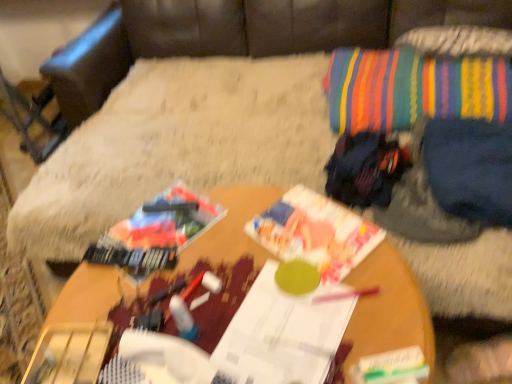
This screenshot has width=512, height=384. Find the location of `wooden table at center`. wooden table at center is located at coordinates (388, 308).

Describe the element at coordinates (388, 308) in the screenshot. I see `wooden table at center` at that location.

Describe the element at coordinates (412, 89) in the screenshot. I see `striped fabric throw pillow at upper right` at that location.

Image resolution: width=512 pixels, height=384 pixels. Find the location of `dark blue fabric at upper right`. dark blue fabric at upper right is located at coordinates (470, 168).

Identify the location of multicolored fabric bean bag chair at upper right. The height and width of the screenshot is (384, 512). (247, 34).

You are a GUI agent. You are given a task and a screenshot of the screen. Output one action in this format:
    pyautogui.click(x=<x>, y=<y>)
    Task: Click on the wooden table at center
    Image resolution: width=512 pixels, height=384 pixels.
    Given the screenshot: What is the action you would take?
    pyautogui.click(x=388, y=308)

From a real-world perspective, is dark blue fabric at upper right above or below multicolored fabric bean bag chair at upper right?

Clearly, from a real-world perspective, dark blue fabric at upper right is above multicolored fabric bean bag chair at upper right.

Which is behind, point (510, 200) or point (229, 27)?

Positioned behind is point (229, 27).

Is dark blue fabric at upper right positioned with its back to multicolored fabric bean bag chair at upper right?

Correct, dark blue fabric at upper right is looking away from multicolored fabric bean bag chair at upper right.

From the picture: Which object is more forward, dark blue fabric at upper right or multicolored fabric bean bag chair at upper right?

multicolored fabric bean bag chair at upper right is in front.

From a real-world perspective, is printed paper magazine at center, positioned as the 1th magazine in top-to-bottom order, over white paper magazine at center, positioned as the 1th magazine in bottom-to-top order?

Correct, in the physical world, printed paper magazine at center, positioned as the 1th magazine in top-to-bottom order, is higher than white paper magazine at center, positioned as the 1th magazine in bottom-to-top order.

This screenshot has width=512, height=384. There is a white paper magazine at center, positioned as the 1th magazine in bottom-to-top order. In order to click on magazine above it (from a real-world perspective) in this screenshot , I will do `click(315, 232)`.

Is point (372, 225) closer or farther from the camera than point (215, 348)?

Clearly, point (372, 225) is more distant from the camera than point (215, 348).

Considering the sizes of objects wooden table at center and printed paper magazine at center, positioned as the 1th magazine in top-to-bottom order, in the image provided, who is wider, wooden table at center or printed paper magazine at center, positioned as the 1th magazine in top-to-bottom order,?

wooden table at center.

Is wooden table at center looking in the opposite direction of printed paper magazine at center, positioned as the 2th magazine in bottom-to-top order?

That's not correct — wooden table at center is not looking away from printed paper magazine at center, positioned as the 2th magazine in bottom-to-top order.

From the picture: From the image's perspective, does wooden table at center appear lower than printed paper magazine at center, positioned as the 1th magazine in top-to-bottom order?

Yes, from the image's perspective, wooden table at center is beneath printed paper magazine at center, positioned as the 1th magazine in top-to-bottom order.

Visually, is wooden table at center positioned to the left or to the right of printed paper magazine at center, positioned as the 1th magazine in top-to-bottom order?

Clearly, wooden table at center is on the left of printed paper magazine at center, positioned as the 1th magazine in top-to-bottom order, in the image.

Is dark blue fabric at upper right further to camera compared to striped fabric throw pillow at upper right?

No, dark blue fabric at upper right is in front of striped fabric throw pillow at upper right.

Could you tell me if dark blue fabric at upper right is turned towards striped fabric throw pillow at upper right?

No, dark blue fabric at upper right is not oriented towards striped fabric throw pillow at upper right.

Between point (447, 162) and point (352, 69), which one is positioned in front?

The point (447, 162) is more forward.

Which is closer to the camera, (361,300) or (64,270)?

The point (361,300) is in front.

How much distance is there between wooden table at center and multicolored fabric bean bag chair at upper right?

wooden table at center and multicolored fabric bean bag chair at upper right are 1.28 meters apart from each other.

Is there a large distance between wooden table at center and multicolored fabric bean bag chair at upper right?

Yes, wooden table at center is far from multicolored fabric bean bag chair at upper right.

This screenshot has height=384, width=512. What are the coordinates of `bean bag chair above the wooden table at center (from the image's perspective)` in the screenshot? It's located at (247, 34).

Is white paper magazine at center, arranged as the second magazine when viewed from the top, not close to wooden table at center?

white paper magazine at center, arranged as the second magazine when viewed from the top, is actually quite close to wooden table at center.

This screenshot has width=512, height=384. Identify the location of the 1st magazine behind when counting from the wooden table at center. (283, 333).

From the image's perspective, is white paper magazine at center, positioned as the 1th magazine in bottom-to-top order, under wooden table at center?

Actually, white paper magazine at center, positioned as the 1th magazine in bottom-to-top order, appears above wooden table at center in the image.

From a real-world perspective, is white paper magazine at center, arranged as the second magazine when viewed from the top, beneath wooden table at center?

No, from a real-world perspective, white paper magazine at center, arranged as the second magazine when viewed from the top, is not below wooden table at center.

Between printed paper magazine at center, positioned as the 1th magazine in top-to-bottom order, and wooden table at center, which one has less height?

With less height is printed paper magazine at center, positioned as the 1th magazine in top-to-bottom order.

Is printed paper magazine at center, positioned as the 2th magazine in bottom-to-top order, facing towards wooden table at center?

Yes, printed paper magazine at center, positioned as the 2th magazine in bottom-to-top order, is facing wooden table at center.

What's the angular difference between printed paper magazine at center, positioned as the 2th magazine in bottom-to-top order, and wooden table at center's facing directions?

The angle between the facing direction of printed paper magazine at center, positioned as the 2th magazine in bottom-to-top order, and the facing direction of wooden table at center is 61.2 degrees.

Measure the distance between printed paper magazine at center, positioned as the 2th magazine in bottom-to-top order, and wooden table at center.

printed paper magazine at center, positioned as the 2th magazine in bottom-to-top order, and wooden table at center are 10.82 centimeters apart from each other.

Locate an element on the screen. The height and width of the screenshot is (384, 512). bean bag chair in front of the dark blue fabric at upper right is located at coordinates (247, 34).

Locate an element on the screen. The width and height of the screenshot is (512, 384). magazine below the printed paper magazine at center, positioned as the 2th magazine in bottom-to-top order (from a real-world perspective) is located at coordinates (283, 333).

Which object lies nearer to the anchor point wooden table at center, printed paper magazine at center, positioned as the 2th magazine in bottom-to-top order, or white paper magazine at center, positioned as the 1th magazine in bottom-to-top order?

printed paper magazine at center, positioned as the 2th magazine in bottom-to-top order.

When comparing their distances from striped fabric throw pillow at upper right, does printed paper magazine at center, positioned as the 2th magazine in bottom-to-top order, or wooden table at center seem further?

Among the two, wooden table at center is located further to striped fabric throw pillow at upper right.

Estimate the real-world distances between objects in this image. Which object is further from printed paper magazine at center, positioned as the 1th magazine in top-to-bottom order, multicolored fabric bean bag chair at upper right or dark blue fabric at upper right?

Based on the image, multicolored fabric bean bag chair at upper right appears to be further to printed paper magazine at center, positioned as the 1th magazine in top-to-bottom order.

Based on their spatial positions, is white paper magazine at center, positioned as the 1th magazine in bottom-to-top order, or printed paper magazine at center, positioned as the 1th magazine in top-to-bottom order, closer to dark blue fabric at upper right?

The object closer to dark blue fabric at upper right is printed paper magazine at center, positioned as the 1th magazine in top-to-bottom order.

Based on their spatial positions, is wooden table at center or printed paper magazine at center, positioned as the 2th magazine in bottom-to-top order, further from dark blue fabric at upper right?

wooden table at center is positioned further to the anchor dark blue fabric at upper right.

When comparing their distances from dark blue fabric at upper right, does wooden table at center or striped fabric throw pillow at upper right seem closer?

Based on the image, striped fabric throw pillow at upper right appears to be nearer to dark blue fabric at upper right.

Looking at the image, which one is located closer to printed paper magazine at center, positioned as the 1th magazine in top-to-bottom order, striped fabric throw pillow at upper right or wooden table at center?

wooden table at center lies closer to printed paper magazine at center, positioned as the 1th magazine in top-to-bottom order, than the other object.

Based on their spatial positions, is wooden table at center or white paper magazine at center, positioned as the 1th magazine in bottom-to-top order, further from multicolored fabric bean bag chair at upper right?

white paper magazine at center, positioned as the 1th magazine in bottom-to-top order.

Image resolution: width=512 pixels, height=384 pixels. What are the coordinates of `throw pillow between printed paper magazine at center, positioned as the 1th magazine in top-to-bottom order, and dark blue fabric at upper right from left to right` in the screenshot? It's located at (412, 89).

At what (x,y) coordinates should I click in order to perform the action: click on magazine between striped fabric throw pillow at upper right and white paper magazine at center, arranged as the second magazine when viewed from the top, in the up-down direction. Please return your answer as a coordinate pair (x, y). The height and width of the screenshot is (384, 512). Looking at the image, I should click on (315, 232).

What are the coordinates of `clothing between striped fabric throw pillow at upper right and white paper magazine at center, positioned as the 1th magazine in bottom-to-top order, in the vertical direction` in the screenshot? It's located at (470, 168).

You are a GUI agent. You are given a task and a screenshot of the screen. Output one action in this format:
    pyautogui.click(x=<x>, y=<y>)
    Task: Click on the clothing between multicolored fabric bean bag chair at upper right and striped fabric throw pillow at upper right along the z-axis
    
    Given the screenshot: What is the action you would take?
    pyautogui.click(x=470, y=168)